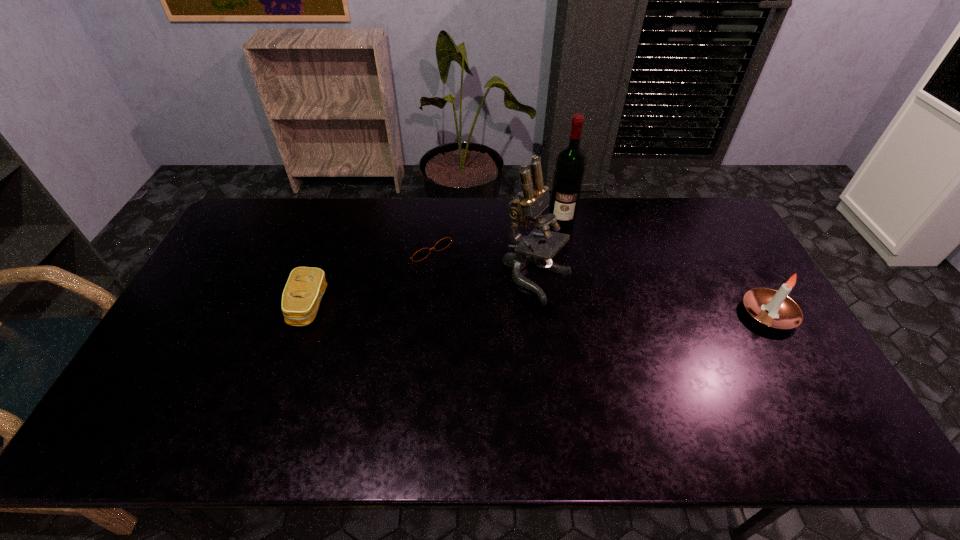
Locate an element on the screen. The height and width of the screenshot is (540, 960). free spot located at the eyepieces of the microscope is located at coordinates (694, 356).

Identify the location of sunglasses present at the far edge. The width and height of the screenshot is (960, 540). (443, 243).

At what (x,y) coordinates should I click in order to perform the action: click on alcohol that is at the far edge. Please return your answer as a coordinate pair (x, y). The image size is (960, 540). Looking at the image, I should click on (570, 165).

This screenshot has height=540, width=960. I want to click on object situated at the right edge, so click(x=771, y=308).

Image resolution: width=960 pixels, height=540 pixels. I want to click on vacant space at the far edge of the desktop, so click(643, 216).

In the image, there is a desktop. At what (x,y) coordinates should I click in order to perform the action: click on vacant space at the near edge. Please return your answer as a coordinate pair (x, y). This screenshot has height=540, width=960. Looking at the image, I should click on point(406,378).

In the image, there is a desktop. At what (x,y) coordinates should I click in order to perform the action: click on vacant space at the left edge. Please return your answer as a coordinate pair (x, y). Looking at the image, I should click on (196, 302).

In the image, there is a desktop. At what (x,y) coordinates should I click in order to perform the action: click on blank space at the near left corner. Please return your answer as a coordinate pair (x, y). The height and width of the screenshot is (540, 960). Looking at the image, I should click on (200, 382).

Locate an element on the screen. This screenshot has height=540, width=960. free space at the far right corner of the desktop is located at coordinates (694, 199).

I want to click on vacant point located between the sunglasses and the alcohol, so click(x=492, y=232).